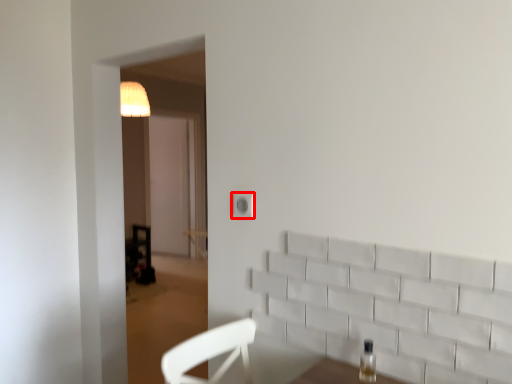
Question: Considering the relative positions of electric outlet (annotated by the red box) and bottle in the image provided, where is electric outlet (annotated by the red box) located with respect to the staircase?

Choices:
 (A) right
 (B) left

Answer: (B)